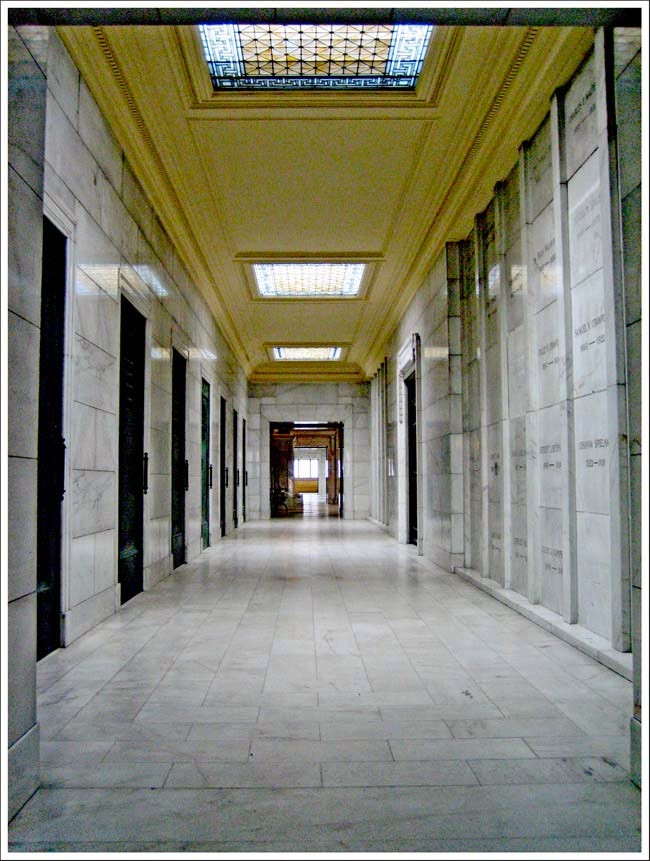
Find the location of a particular element. The image size is (650, 861). the closest tiles is located at coordinates (110, 784), (225, 769), (369, 766), (489, 771), (586, 769).